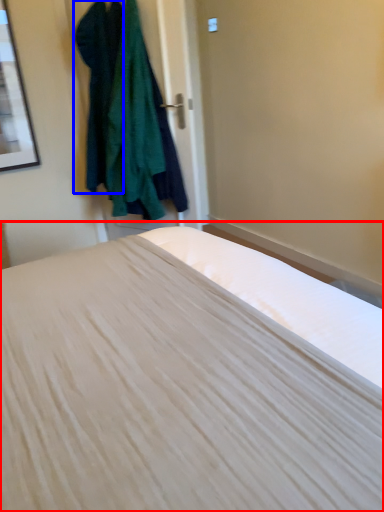
Question: Among these objects, which one is farthest to the camera, bed (highlighted by a red box) or clothing (highlighted by a blue box)?

Choices:
 (A) bed
 (B) clothing

Answer: (B)